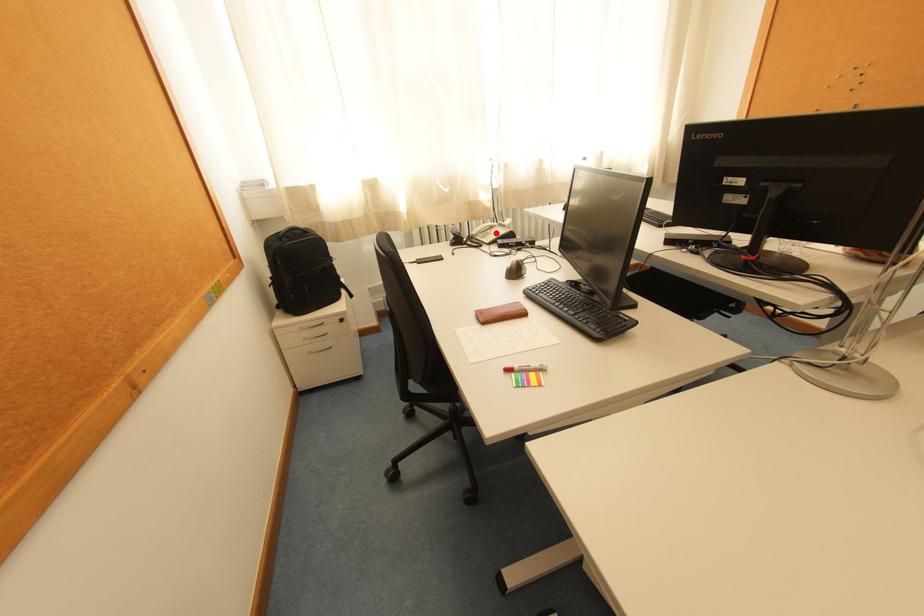
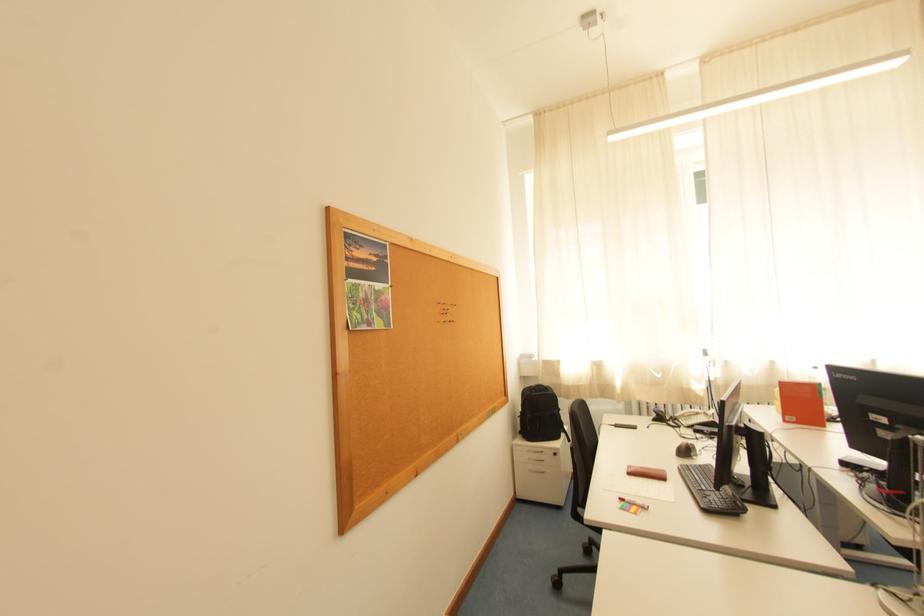
Locate, in the second image, the point that corresponds to the highlighted location in the first image.

(699, 418)